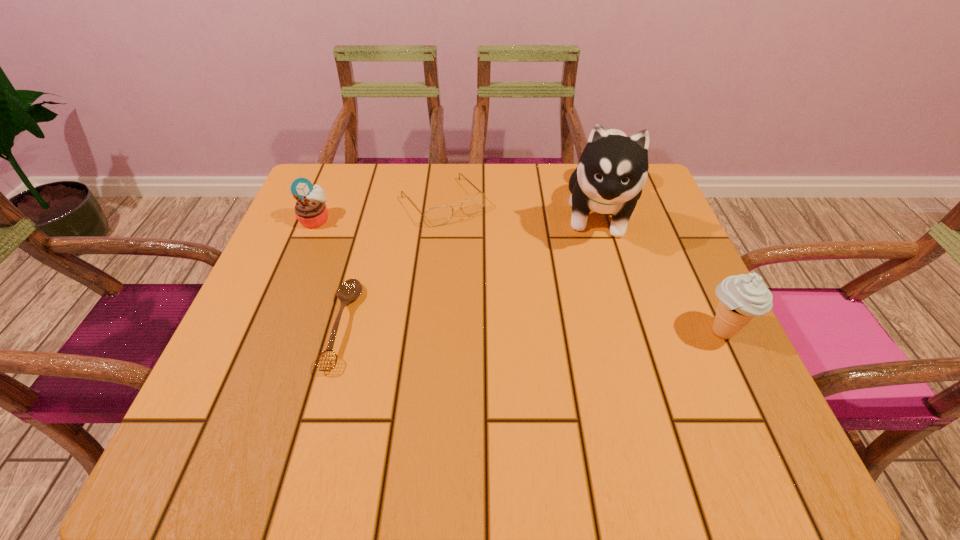
I want to click on vacant space located on the front-facing side of the third object from left to right, so click(x=507, y=276).

Where is `puppy located at the far edge`? The width and height of the screenshot is (960, 540). puppy located at the far edge is located at coordinates coord(613,168).

Identify the location of muffin at the far edge. This screenshot has width=960, height=540. (310, 209).

Find the location of a particular element. The image size is (960, 540). spectacles at the far edge is located at coordinates (436, 216).

In order to click on object that is at the near edge in this screenshot , I will do `click(351, 289)`.

You are a GUI agent. You are given a task and a screenshot of the screen. Output one action in this format:
    pyautogui.click(x=<x>, y=<y>)
    Task: Click on the object present at the left edge
    
    Given the screenshot: What is the action you would take?
    pyautogui.click(x=310, y=209)

Locate an element on the screen. The height and width of the screenshot is (540, 960). icecream that is at the right edge is located at coordinates (742, 297).

Find the location of a particular element. puppy that is at the right edge is located at coordinates click(x=613, y=168).

This screenshot has height=540, width=960. What are the coordinates of `object at the far left corner` in the screenshot? It's located at (310, 209).

I want to click on object located at the far right corner, so click(x=613, y=168).